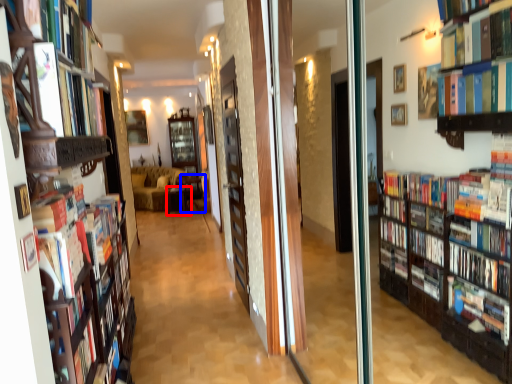
Question: Which object appears closest to the camera in this image, furniture (highlighted by a red box) or furniture (highlighted by a blue box)?

Choices:
 (A) furniture
 (B) furniture

Answer: (B)